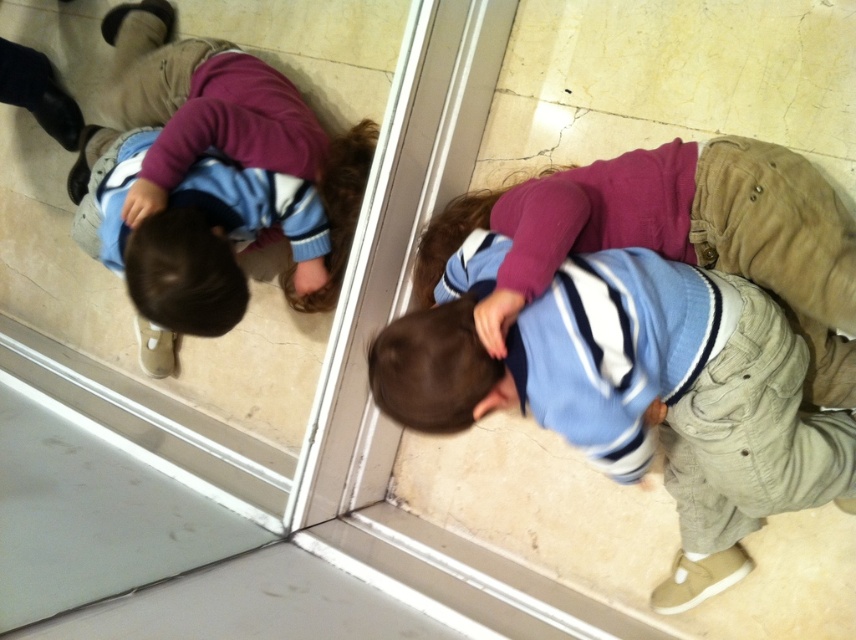
You are a delivery person trying to place a small package on the floor near the transparent glass door at center without blocking the view through it. The package must be placed within 24 inches of the matte blue sweater at lower center. Can you position the package in a way that meets both requirements?

The transparent glass door at center is 25.57 inches from the matte blue sweater at lower center. Since the required distance is within 24 inches, the package cannot be placed close enough to the sweater without exceeding the 24 inch limit while still being near the door. Therefore, it is not possible to meet both requirements.